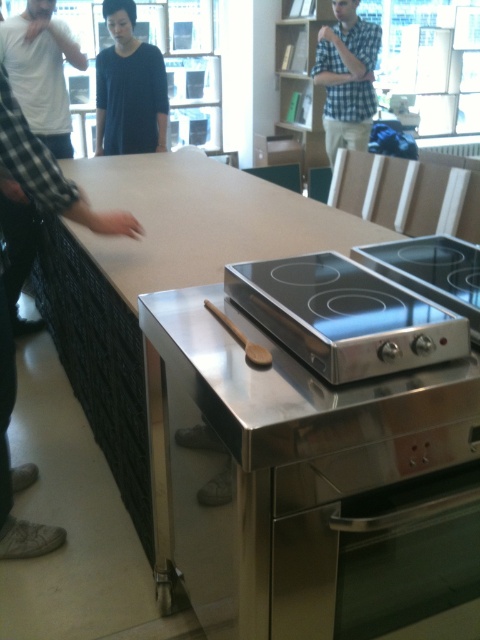
The width and height of the screenshot is (480, 640). What are the coordinates of `dark blue shirt at upper center` in the screenshot? It's located at (129, 88).

Where is `dark blue shirt at upper center`? The width and height of the screenshot is (480, 640). dark blue shirt at upper center is located at coordinates (129, 88).

Which of these two, stainless steel cooktop at lower right or stainless steel cooktop at center, stands taller?

Standing taller between the two is stainless steel cooktop at lower right.

Between point (362, 269) and point (387, 246), which one is positioned behind?

The point (387, 246) is behind.

Image resolution: width=480 pixels, height=640 pixels. What do you see at coordinates (346, 316) in the screenshot?
I see `stainless steel cooktop at lower right` at bounding box center [346, 316].

The image size is (480, 640). What are the coordinates of `stainless steel cooktop at lower right` in the screenshot? It's located at (346, 316).

Identify the location of stainless steel cooktop at lower right. (346, 316).

Can you confirm if stainless steel cooktop at lower right is positioned to the right of wooden bookshelf at upper center?

No, stainless steel cooktop at lower right is not to the right of wooden bookshelf at upper center.

This screenshot has width=480, height=640. I want to click on stainless steel cooktop at lower right, so click(346, 316).